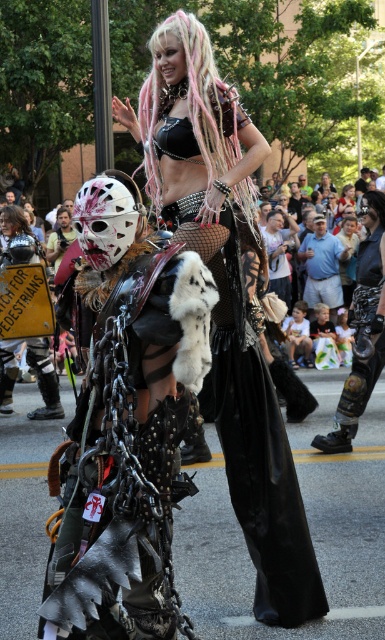
Does black leather skirt at center have a lesser width compared to matte black helmet at left?

Correct, black leather skirt at center's width is less than matte black helmet at left's.

Locate an element on the screen. The image size is (385, 640). black leather skirt at center is located at coordinates [252, 432].

Locate an element on the screen. black leather skirt at center is located at coordinates (252, 432).

Who is taller, matte black helmet at left or metallic chainmail helmet at left?

matte black helmet at left

Which is behind, point (262, 337) or point (1, 380)?

Positioned behind is point (1, 380).

Identify the location of matte black helmet at left. The width and height of the screenshot is (385, 640). (329, 246).

Can you confirm if black leather skirt at center is taller than metallic chainmail helmet at left?

Yes.

Does black leather skirt at center have a greater width compared to metallic chainmail helmet at left?

Yes.

Between point (279, 563) and point (16, 346), which one is positioned behind?

Point (16, 346)

Find the location of a particular element. The width and height of the screenshot is (385, 640). black leather skirt at center is located at coordinates (252, 432).